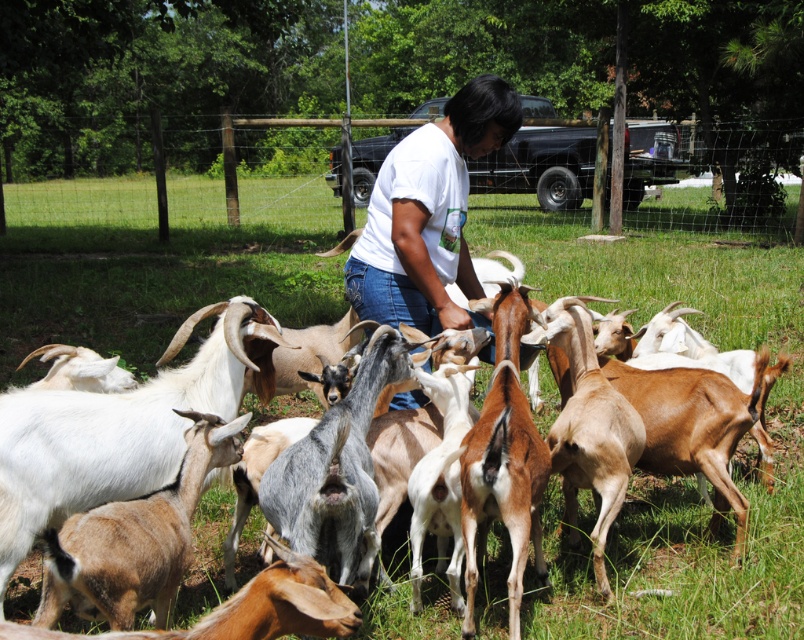
Question: Observing the image, what is the correct spatial positioning of green grass at center in reference to white cotton shirt at center?

Choices:
 (A) left
 (B) right

Answer: (A)

Question: Which of the following is the farthest from the observer?

Choices:
 (A) green grass at center
 (B) white cotton shirt at center

Answer: (B)

Question: Observing the image, what is the correct spatial positioning of green grass at center in reference to white cotton shirt at center?

Choices:
 (A) right
 (B) left

Answer: (B)

Question: Which object appears closest to the camera in this image?

Choices:
 (A) white cotton shirt at center
 (B) green grass at center

Answer: (B)

Question: Observing the image, what is the correct spatial positioning of green grass at center in reference to white cotton shirt at center?

Choices:
 (A) below
 (B) above

Answer: (B)